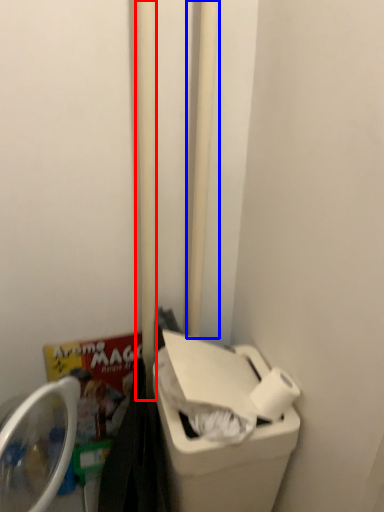
Question: Among these objects, which one is nearest to the camera, pole (highlighted by a red box) or pole (highlighted by a blue box)?

Choices:
 (A) pole
 (B) pole

Answer: (A)